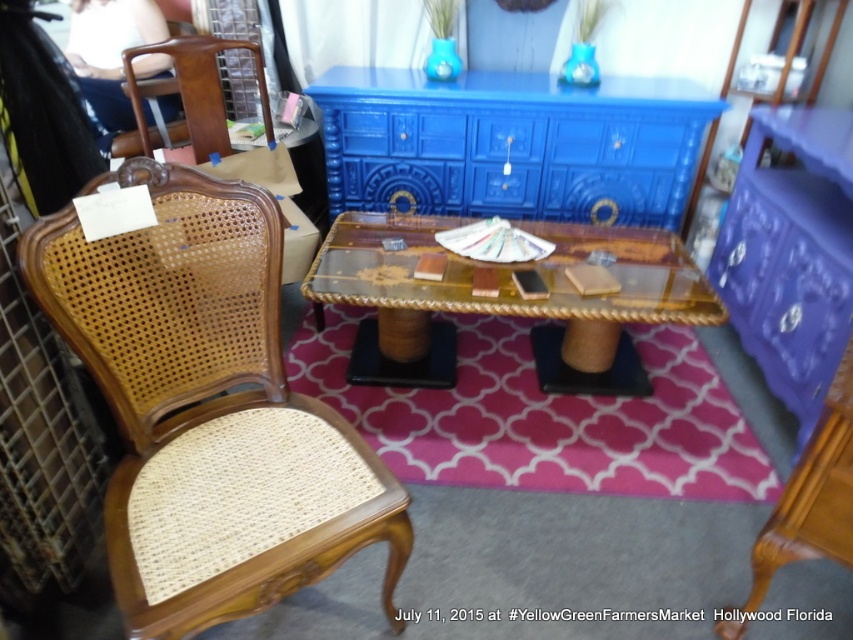
You are a delivery person trying to move a large box from the wooden cane armchair at left to the blue painted wood dresser at upper center. The box is 4 feet long. Can you slide the box horizontally between them without tilting it?

The wooden cane armchair at left and blue painted wood dresser at upper center are 4.60 feet apart. Since the box is 4 feet long, there is enough space to slide it horizontally between them without tilting.

You are setting up a display at the YellowGreenFarmersMarket. You have a wooden cane armchair at left and a blue painted wood dresser at upper center. Which object should you place closer to the entrance to ensure it is more noticeable to customers?

The blue painted wood dresser at upper center should be placed closer to the entrance because it is larger than the wooden cane armchair at left, making it more noticeable to customers.

You are a customer at the YellowGreenFarmersMarket in Hollywood, Florida. You see a wooden cane armchair at left and a transparent acrylic table at center. Which object is taller?

The wooden cane armchair at left is much taller than the transparent acrylic table at center.